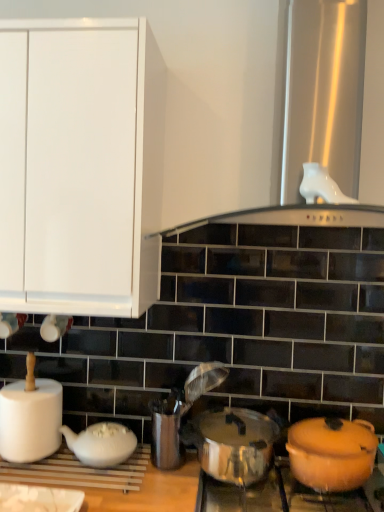
Question: Can you confirm if white glossy vent at upper center is positioned to the right of white matte paper towel at left?

Choices:
 (A) yes
 (B) no

Answer: (A)

Question: Is white glossy vent at upper center far away from white matte paper towel at left?

Choices:
 (A) yes
 (B) no

Answer: (B)

Question: Can you confirm if white glossy vent at upper center is thinner than white matte paper towel at left?

Choices:
 (A) yes
 (B) no

Answer: (B)

Question: Is white glossy vent at upper center wider than white matte paper towel at left?

Choices:
 (A) no
 (B) yes

Answer: (B)

Question: Is white glossy vent at upper center with white matte paper towel at left?

Choices:
 (A) yes
 (B) no

Answer: (B)

Question: Is white glossy vent at upper center facing towards white matte paper towel at left?

Choices:
 (A) yes
 (B) no

Answer: (B)

Question: Is orange matte pot at lower right surrounded by white matte paper towel at left?

Choices:
 (A) yes
 (B) no

Answer: (B)

Question: Does white matte paper towel at left have a greater height compared to orange matte pot at lower right?

Choices:
 (A) no
 (B) yes

Answer: (B)

Question: Is the surface of white matte paper towel at left in direct contact with orange matte pot at lower right?

Choices:
 (A) no
 (B) yes

Answer: (A)

Question: Is white matte paper towel at left at the left side of orange matte pot at lower right?

Choices:
 (A) no
 (B) yes

Answer: (B)

Question: From a real-world perspective, is white matte paper towel at left located beneath orange matte pot at lower right?

Choices:
 (A) yes
 (B) no

Answer: (B)

Question: Considering the relative sizes of white matte paper towel at left and orange matte pot at lower right in the image provided, is white matte paper towel at left bigger than orange matte pot at lower right?

Choices:
 (A) no
 (B) yes

Answer: (B)

Question: From the image's perspective, does metallic silver crock pot at center appear higher than white matte paper towel at left?

Choices:
 (A) no
 (B) yes

Answer: (A)